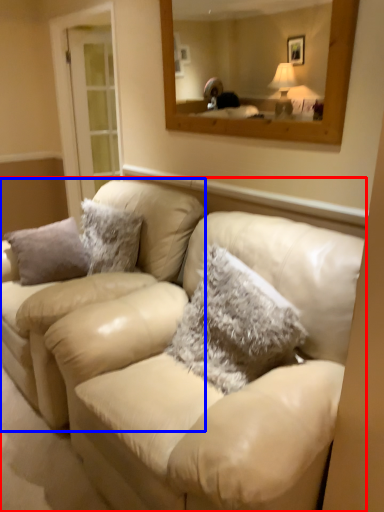
Question: Among these objects, which one is farthest to the camera, studio couch (highlighted by a red box) or couch (highlighted by a blue box)?

Choices:
 (A) studio couch
 (B) couch

Answer: (B)